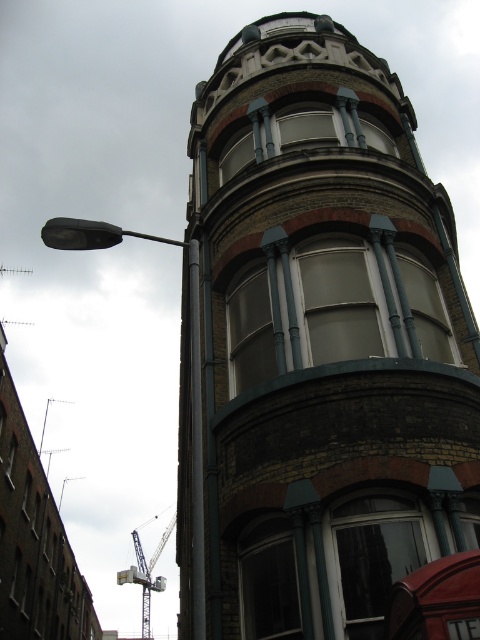
You are a GUI agent. You are given a task and a screenshot of the screen. Output one action in this format:
    pyautogui.click(x=<x>, y=<y>)
    Task: Click on the black metal streetlight at left
    
    Given the screenshot: What is the action you would take?
    pos(190,365)

Describe the element at coordinates (190, 365) in the screenshot. I see `black metal streetlight at left` at that location.

Identify the location of black metal streetlight at left. (190, 365).

Can you confirm if brown brick tower at upper center is bigger than black metal streetlight at left?

No.

Between brown brick tower at upper center and black metal streetlight at left, which one is positioned higher?

Positioned higher is black metal streetlight at left.

What do you see at coordinates (316, 344) in the screenshot? The height and width of the screenshot is (640, 480). I see `brown brick tower at upper center` at bounding box center [316, 344].

Where is `brown brick tower at upper center`? brown brick tower at upper center is located at coordinates (316, 344).

Does brown brick tower at upper center appear on the right side of metallic gray crane at lower left?

Correct, you'll find brown brick tower at upper center to the right of metallic gray crane at lower left.

Between brown brick tower at upper center and metallic gray crane at lower left, which one appears on the right side from the viewer's perspective?

Positioned to the right is brown brick tower at upper center.

What do you see at coordinates (316, 344) in the screenshot? I see `brown brick tower at upper center` at bounding box center [316, 344].

Locate an element on the screen. brown brick tower at upper center is located at coordinates pyautogui.click(x=316, y=344).